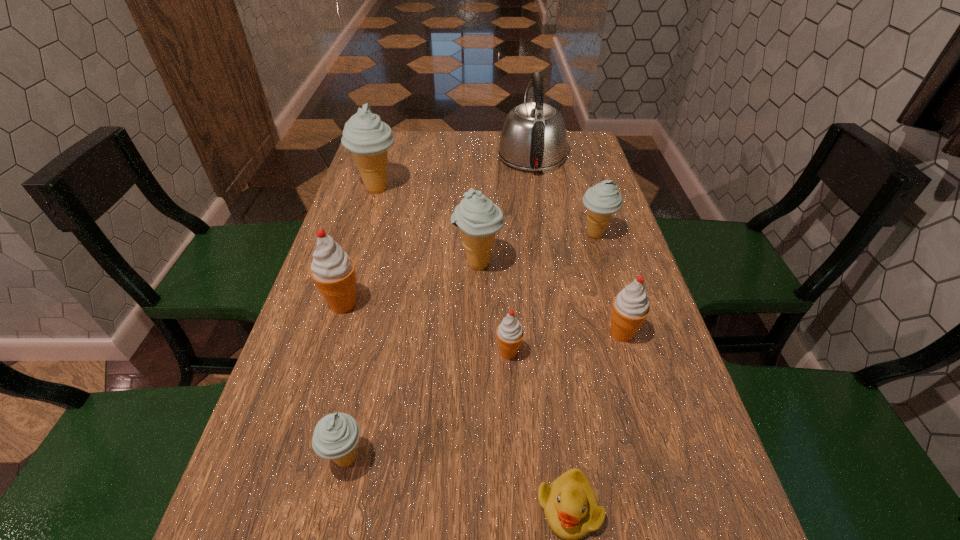
At what (x,y) coordinates should I click in order to perform the action: click on kettle. Please return your answer as a coordinate pair (x, y). The image size is (960, 540). Looking at the image, I should click on (533, 138).

Identify the location of the farthest icecream. This screenshot has width=960, height=540. (368, 138).

Locate an element on the screen. the farthest beige icecream is located at coordinates [368, 138].

Identify the location of the second nearest beige icecream. The image size is (960, 540). (478, 218).

The image size is (960, 540). I want to click on the fifth nearest icecream, so click(478, 218).

The width and height of the screenshot is (960, 540). Find the location of `the biggest red icecream`. the biggest red icecream is located at coordinates (333, 271).

The width and height of the screenshot is (960, 540). I want to click on the fourth farthest icecream, so (x=333, y=271).

The image size is (960, 540). In order to click on the rightmost red icecream in this screenshot , I will do `click(630, 308)`.

What are the coordinates of `the seventh nearest object` in the screenshot? It's located at (602, 200).

At what (x,y) coordinates should I click in order to perform the action: click on the third biggest beige icecream. Please return your answer as a coordinate pair (x, y). The height and width of the screenshot is (540, 960). Looking at the image, I should click on (602, 200).